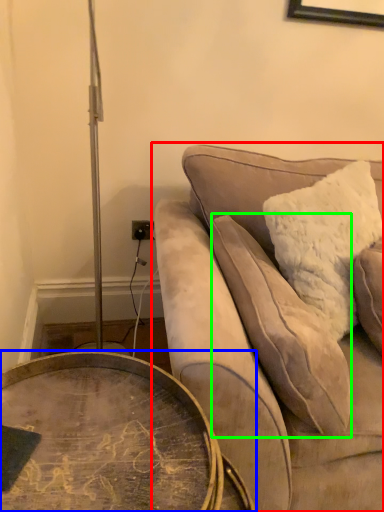
Question: Based on their relative distances, which object is nearer to studio couch (highlighted by a red box)? Choose from coffee table (highlighted by a blue box) and pillow (highlighted by a green box).

Choices:
 (A) coffee table
 (B) pillow

Answer: (B)